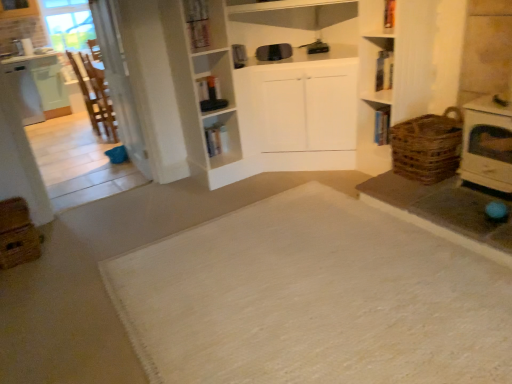
Question: Should I look upward or downward to see white woven mat at center?

Choices:
 (A) up
 (B) down

Answer: (B)

Question: Does brown woven basket at right appear on the right side of white woven mat at center?

Choices:
 (A) yes
 (B) no

Answer: (A)

Question: Does brown woven basket at right have a greater height compared to white woven mat at center?

Choices:
 (A) yes
 (B) no

Answer: (A)

Question: Is brown woven basket at right closer to camera compared to white woven mat at center?

Choices:
 (A) yes
 (B) no

Answer: (B)

Question: Can you confirm if brown woven basket at right is bigger than white woven mat at center?

Choices:
 (A) no
 (B) yes

Answer: (A)

Question: From a real-world perspective, is brown woven basket at right physically below white woven mat at center?

Choices:
 (A) yes
 (B) no

Answer: (B)

Question: Can white woven mat at center be found inside brown woven basket at right?

Choices:
 (A) yes
 (B) no

Answer: (B)

Question: Is wooden chair at left in front of brown woven basket at right?

Choices:
 (A) no
 (B) yes

Answer: (A)

Question: Is wooden chair at left far from brown woven basket at right?

Choices:
 (A) yes
 (B) no

Answer: (A)

Question: Is wooden chair at left behind brown woven basket at right?

Choices:
 (A) yes
 (B) no

Answer: (A)

Question: Is wooden chair at left outside brown woven basket at right?

Choices:
 (A) no
 (B) yes

Answer: (B)

Question: Is wooden chair at left taller than brown woven basket at right?

Choices:
 (A) yes
 (B) no

Answer: (A)

Question: Is wooden chair at left thinner than brown woven basket at right?

Choices:
 (A) yes
 (B) no

Answer: (A)

Question: Considering the relative sizes of brown woven basket at right and brown woven crate at lower left in the image provided, is brown woven basket at right taller than brown woven crate at lower left?

Choices:
 (A) no
 (B) yes

Answer: (B)